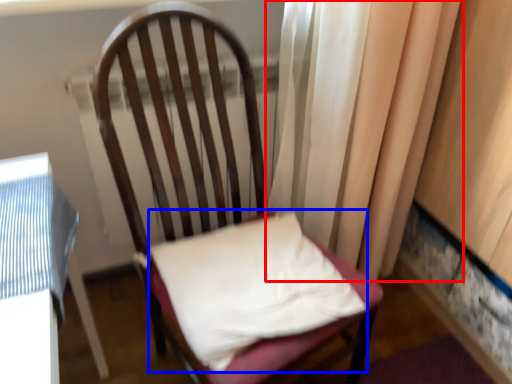
Question: Which of the following is the farthest to the observer, curtain (highlighted by a red box) or pillow (highlighted by a blue box)?

Choices:
 (A) curtain
 (B) pillow

Answer: (A)